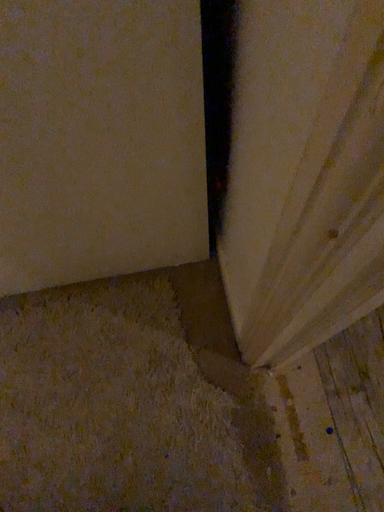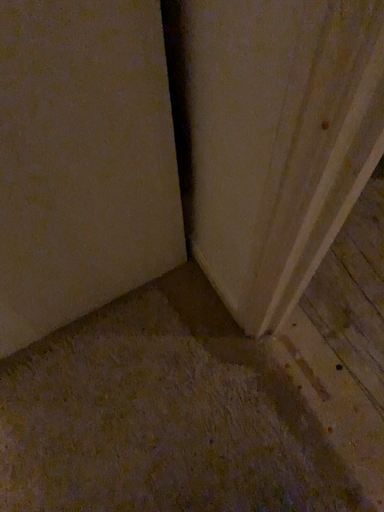
Question: Which way did the camera rotate in the video?

Choices:
 (A) rotated downward
 (B) rotated upward

Answer: (B)